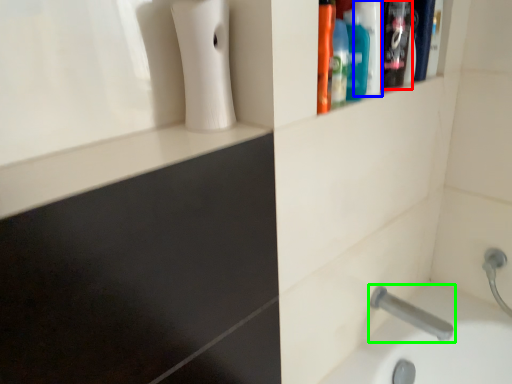
Question: Considering the real-world distances, which object is farthest from cleaning product (highlighted by a red box)? mouthwash (highlighted by a blue box) or tap (highlighted by a green box)?

Choices:
 (A) mouthwash
 (B) tap

Answer: (B)